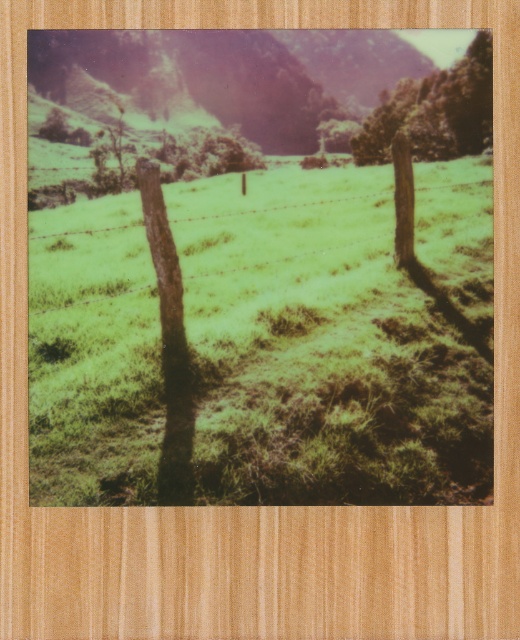
Question: Is green grassy at center in front of green leafy tree at upper center?

Choices:
 (A) no
 (B) yes

Answer: (B)

Question: Which of the following is the farthest from the observer?

Choices:
 (A) green grassy at center
 (B) green leafy tree at upper center

Answer: (B)

Question: Is green grassy at center to the right of green leafy tree at upper center from the viewer's perspective?

Choices:
 (A) no
 (B) yes

Answer: (A)

Question: Is green grassy at center to the left of green leafy tree at upper center from the viewer's perspective?

Choices:
 (A) yes
 (B) no

Answer: (A)

Question: Which point is closer to the camera taking this photo?

Choices:
 (A) tap(471, 490)
 (B) tap(487, 65)

Answer: (A)

Question: Which object is farther from the camera taking this photo?

Choices:
 (A) green leafy tree at upper center
 (B) green grassy at center

Answer: (A)